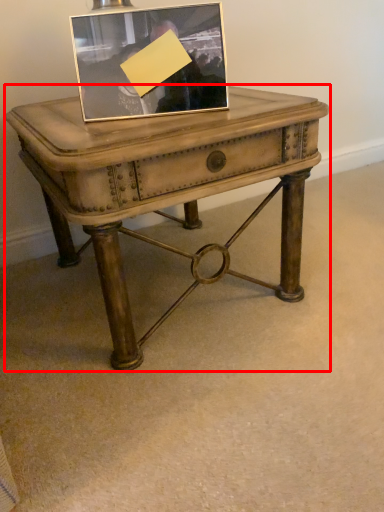
Question: Observing the image, what is the correct spatial positioning of table (annotated by the red box) in reference to picture frame?

Choices:
 (A) left
 (B) right

Answer: (B)